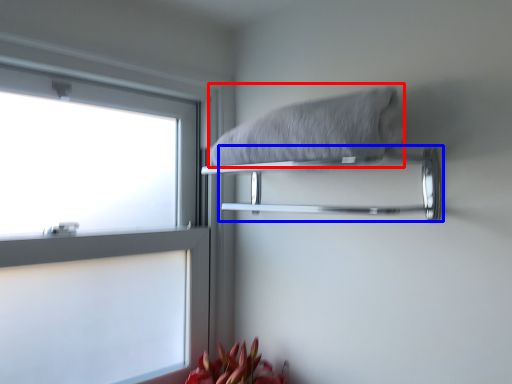
Question: Which point is further to the camera, bath towel (highlighted by a red box) or towel bar (highlighted by a blue box)?

Choices:
 (A) bath towel
 (B) towel bar

Answer: (B)